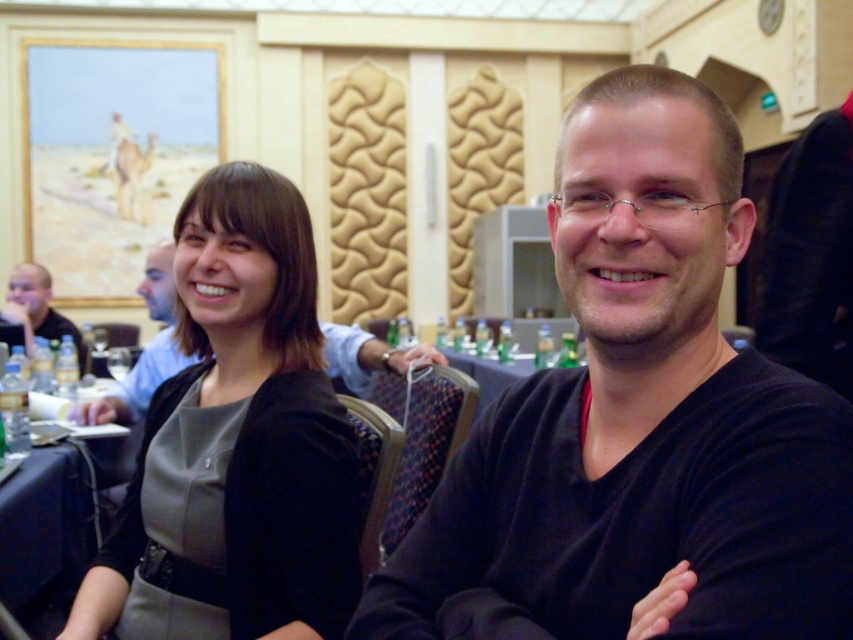
Question: Can you confirm if black matte shirt at center is thinner than matte black shirt at left?

Choices:
 (A) yes
 (B) no

Answer: (A)

Question: Which of the following is the farthest from the observer?

Choices:
 (A) (703, 161)
 (B) (311, 636)
 (C) (74, 413)

Answer: (C)

Question: Estimate the real-world distances between objects in this image. Which object is closer to the matte black shirt at center?

Choices:
 (A) matte black jacket at center
 (B) black matte shirt at center

Answer: (A)

Question: Considering the relative positions of matte black jacket at center and matte black shirt at center in the image provided, where is matte black jacket at center located with respect to matte black shirt at center?

Choices:
 (A) below
 (B) above

Answer: (A)

Question: Which of these objects is positioned farthest from the matte black shirt at center?

Choices:
 (A) matte black shirt at left
 (B) black matte shirt at center

Answer: (B)

Question: Can you confirm if black matte shirt at center is positioned below matte black shirt at center?

Choices:
 (A) yes
 (B) no

Answer: (A)